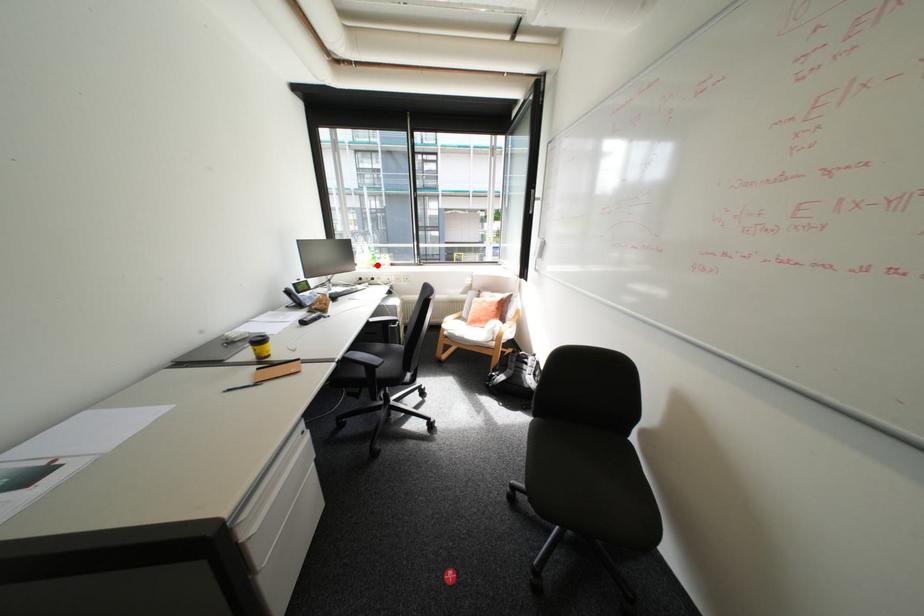
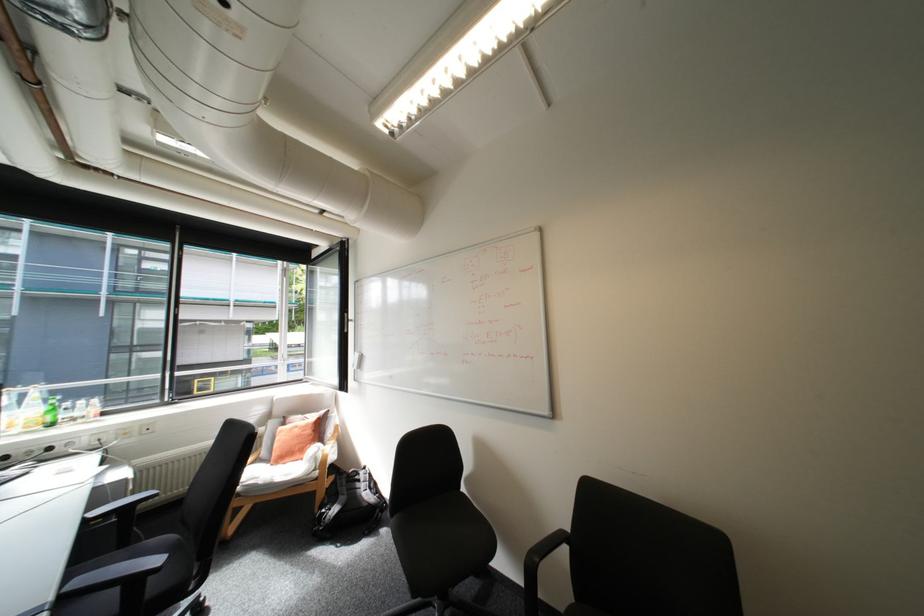
The point at the highlighted location is marked in the first image. Where is the corresponding point in the second image?

(38, 427)